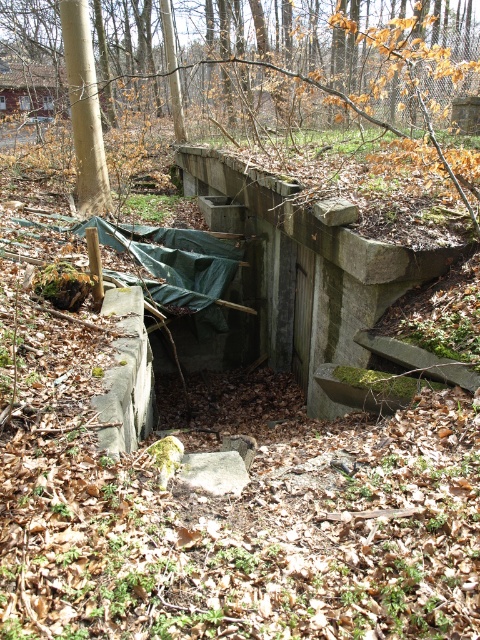
Question: Is the position of brown rough tree at center more distant than that of green mossy concrete bunker at center?

Choices:
 (A) no
 (B) yes

Answer: (A)

Question: Does brown rough tree at center have a smaller size compared to green mossy concrete bunker at center?

Choices:
 (A) yes
 (B) no

Answer: (B)

Question: Is brown rough tree at center positioned in front of green mossy concrete bunker at center?

Choices:
 (A) yes
 (B) no

Answer: (A)

Question: Among these objects, which one is nearest to the camera?

Choices:
 (A) green mossy concrete bunker at center
 (B) brown rough tree at center

Answer: (B)